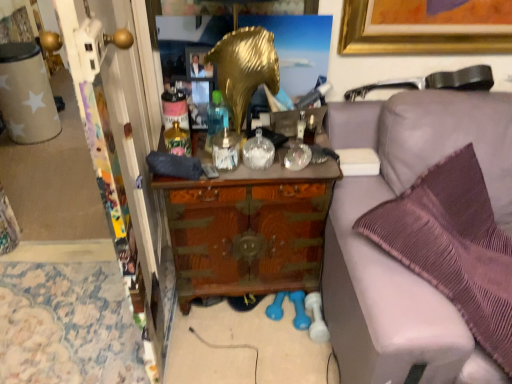
Question: From a real-world perspective, is matte gray remote control at center physically above gold metallic picture frame at upper center?

Choices:
 (A) yes
 (B) no

Answer: (B)

Question: From the image's perspective, would you say matte gray remote control at center is shown under gold metallic picture frame at upper center?

Choices:
 (A) yes
 (B) no

Answer: (A)

Question: Considering the relative sizes of matte gray remote control at center and gold metallic picture frame at upper center in the image provided, is matte gray remote control at center taller than gold metallic picture frame at upper center?

Choices:
 (A) no
 (B) yes

Answer: (A)

Question: Is matte gray remote control at center located outside gold metallic picture frame at upper center?

Choices:
 (A) yes
 (B) no

Answer: (A)

Question: Considering the relative sizes of matte gray remote control at center and gold metallic picture frame at upper center in the image provided, is matte gray remote control at center wider than gold metallic picture frame at upper center?

Choices:
 (A) no
 (B) yes

Answer: (B)

Question: Is matte gray remote control at center positioned before gold metallic picture frame at upper center?

Choices:
 (A) no
 (B) yes

Answer: (B)

Question: Considering the relative positions of beige paper cup at left and wooden chest at center in the image provided, is beige paper cup at left to the left of wooden chest at center from the viewer's perspective?

Choices:
 (A) yes
 (B) no

Answer: (A)

Question: Considering the relative sizes of beige paper cup at left and wooden chest at center in the image provided, is beige paper cup at left shorter than wooden chest at center?

Choices:
 (A) no
 (B) yes

Answer: (B)

Question: Does beige paper cup at left turn towards wooden chest at center?

Choices:
 (A) no
 (B) yes

Answer: (B)

Question: Is wooden chest at center a part of beige paper cup at left?

Choices:
 (A) yes
 (B) no

Answer: (B)

Question: From a real-world perspective, is beige paper cup at left located higher than wooden chest at center?

Choices:
 (A) no
 (B) yes

Answer: (A)

Question: Can you confirm if beige paper cup at left is thinner than wooden chest at center?

Choices:
 (A) no
 (B) yes

Answer: (B)

Question: From a real-world perspective, is wooden chest at center positioned under gold metallic picture frame at upper center based on gravity?

Choices:
 (A) no
 (B) yes

Answer: (B)